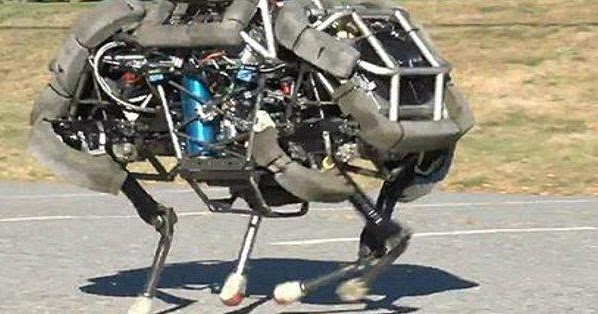
At what (x,y) coordinates should I click in order to perform the action: click on blue cannister. Please return your answer as a coordinate pair (x, y). The image size is (598, 314). Looking at the image, I should click on (207, 130).